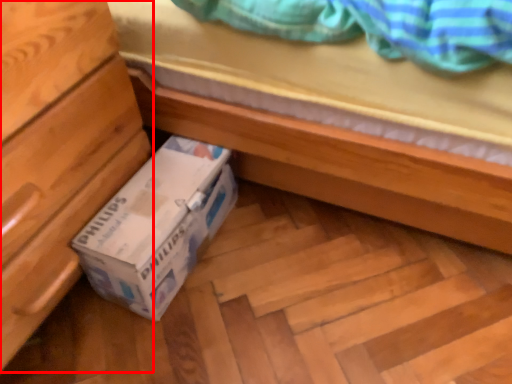
Question: From the image's perspective, considering the relative positions of chest of drawers (annotated by the red box) and box in the image provided, where is chest of drawers (annotated by the red box) located with respect to the staircase?

Choices:
 (A) above
 (B) below

Answer: (A)